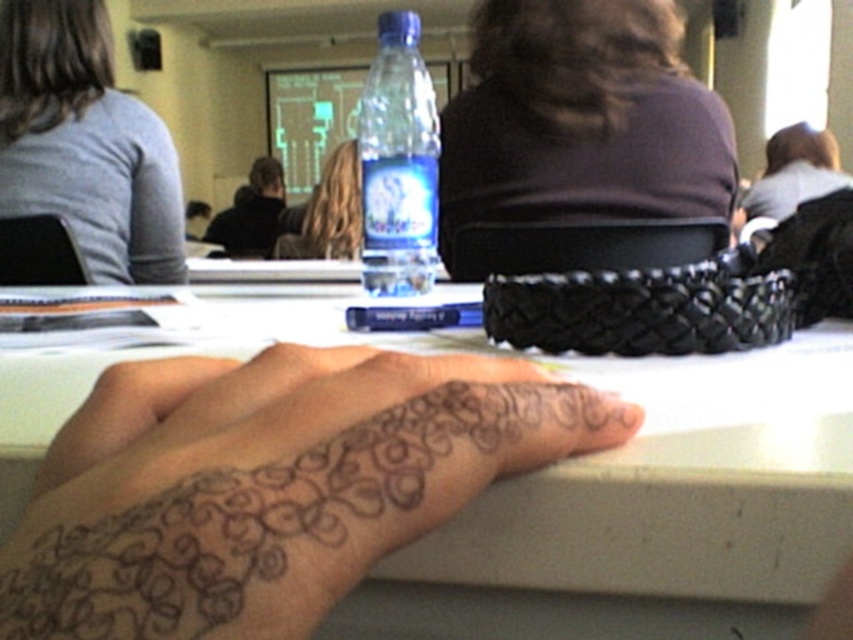
Question: From the image, what is the correct spatial relationship of dark brown fabric at upper center in relation to gray cotton shirt at upper left?

Choices:
 (A) right
 (B) left

Answer: (A)

Question: Which point is farther to the camera?

Choices:
 (A) (630, 45)
 (B) (264, 193)

Answer: (B)

Question: Which point is farther to the camera?

Choices:
 (A) gray cotton shirt at upper left
 (B) black fabric jacket at upper center
 (C) white matte table at center
 (D) dark brown fabric at upper center

Answer: (B)

Question: Is gray cotton shirt at upper left below transparent plastic bottle at center?

Choices:
 (A) yes
 (B) no

Answer: (B)

Question: Is white matte table at center to the right of transparent plastic bottle at center from the viewer's perspective?

Choices:
 (A) yes
 (B) no

Answer: (B)

Question: Which point is closer to the camera?

Choices:
 (A) pos(418,246)
 (B) pos(480,348)
 (C) pos(170,259)

Answer: (B)